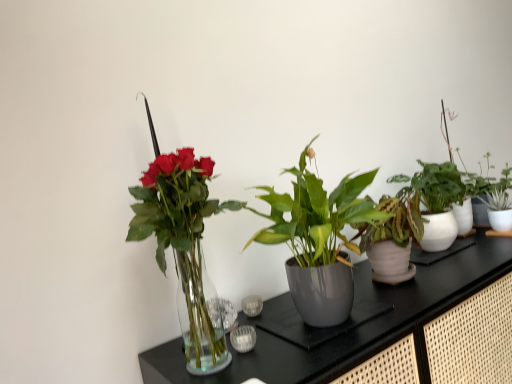
Question: Can you confirm if green glossy plant at center, marked as the 1th houseplant in a left-to-right arrangement, is taller than white glossy pot at right, which is counted as the 1th houseplant, starting from the right?

Choices:
 (A) no
 (B) yes

Answer: (B)

Question: Can you confirm if green glossy plant at center, marked as the 1th houseplant in a left-to-right arrangement, is bigger than white glossy pot at right, acting as the 4th houseplant starting from the left?

Choices:
 (A) yes
 (B) no

Answer: (A)

Question: Can we say green glossy plant at center, marked as the 1th houseplant in a left-to-right arrangement, lies outside white glossy pot at right, which is counted as the 1th houseplant, starting from the right?

Choices:
 (A) no
 (B) yes

Answer: (B)

Question: Can you confirm if green glossy plant at center, placed as the fourth houseplant when sorted from right to left, is positioned to the right of white glossy pot at right, which is counted as the 1th houseplant, starting from the right?

Choices:
 (A) no
 (B) yes

Answer: (A)

Question: Is green glossy plant at center, marked as the 1th houseplant in a left-to-right arrangement, thinner than white glossy pot at right, acting as the 4th houseplant starting from the left?

Choices:
 (A) no
 (B) yes

Answer: (A)

Question: Is transparent glass vase at left inside or outside of green glossy plant at center, marked as the 1th houseplant in a left-to-right arrangement?

Choices:
 (A) outside
 (B) inside

Answer: (A)

Question: Considering the positions of point (257, 352) and point (190, 235), is point (257, 352) closer or farther from the camera than point (190, 235)?

Choices:
 (A) closer
 (B) farther

Answer: (B)

Question: In the image, is transparent glass vase at left on the left side or the right side of green glossy plant at center, placed as the fourth houseplant when sorted from right to left?

Choices:
 (A) right
 (B) left

Answer: (A)

Question: Is transparent glass vase at left in front of or behind green glossy plant at center, placed as the fourth houseplant when sorted from right to left, in the image?

Choices:
 (A) behind
 (B) front

Answer: (B)

Question: From a real-world perspective, relative to white ceramic pot at upper right, the 3th houseplant when ordered from left to right, is glossy ceramic plant pot at center, the 3th houseplant when ordered from right to left, vertically above or below?

Choices:
 (A) above
 (B) below

Answer: (B)

Question: Based on their positions, is glossy ceramic plant pot at center, marked as the second houseplant in a left-to-right arrangement, located to the left or right of white ceramic pot at upper right, which ranks as the second houseplant in right-to-left order?

Choices:
 (A) left
 (B) right

Answer: (A)

Question: Considering their positions, is glossy ceramic plant pot at center, the 3th houseplant when ordered from right to left, located in front of or behind white ceramic pot at upper right, which ranks as the second houseplant in right-to-left order?

Choices:
 (A) behind
 (B) front

Answer: (B)

Question: Considering the positions of point (502, 380) and point (430, 198), is point (502, 380) closer or farther from the camera than point (430, 198)?

Choices:
 (A) farther
 (B) closer

Answer: (B)

Question: From a real-world perspective, is white glossy pot at right, which is counted as the 1th houseplant, starting from the right, physically located above or below white ceramic pot at upper right, which ranks as the second houseplant in right-to-left order?

Choices:
 (A) above
 (B) below

Answer: (B)

Question: From their relative heights in the image, would you say white glossy pot at right, acting as the 4th houseplant starting from the left, is taller or shorter than white ceramic pot at upper right, which ranks as the second houseplant in right-to-left order?

Choices:
 (A) tall
 (B) short

Answer: (B)